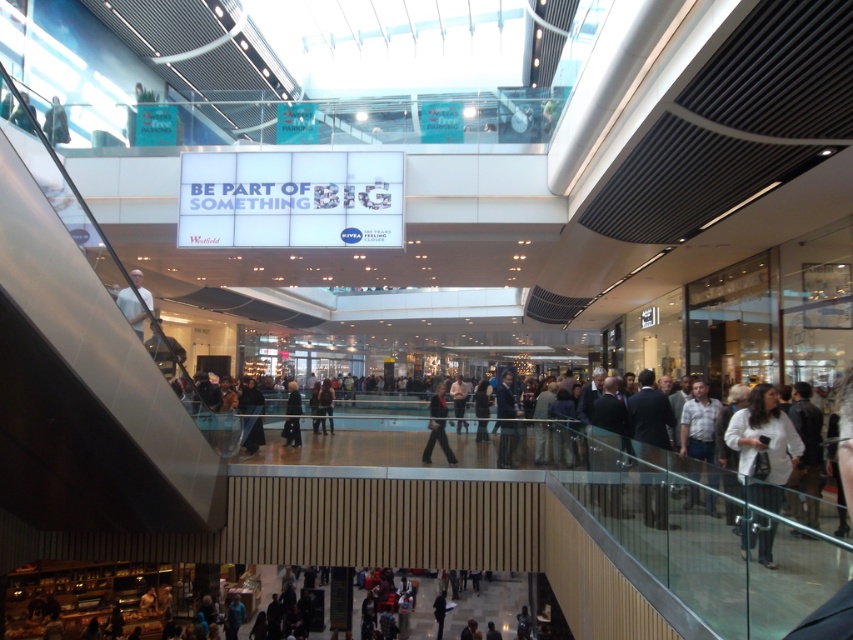
Question: Which object is the farthest from the white matte jacket at lower right?

Choices:
 (A) black fabric at center
 (B) dark gray suit at center

Answer: (A)

Question: In this image, where is white matte jacket at lower right located relative to dark gray suit at center?

Choices:
 (A) above
 (B) below

Answer: (A)

Question: Does dark gray suit at center appear on the left side of black fabric at center?

Choices:
 (A) no
 (B) yes

Answer: (A)

Question: Considering the real-world distances, which object is farthest from the black fabric at center?

Choices:
 (A) white matte jacket at lower right
 (B) dark gray suit at center

Answer: (A)

Question: Estimate the real-world distances between objects in this image. Which object is farther from the dark gray suit at center?

Choices:
 (A) white matte jacket at lower right
 (B) black fabric at center

Answer: (A)

Question: Can you confirm if dark gray suit at center is wider than black fabric at center?

Choices:
 (A) no
 (B) yes

Answer: (A)